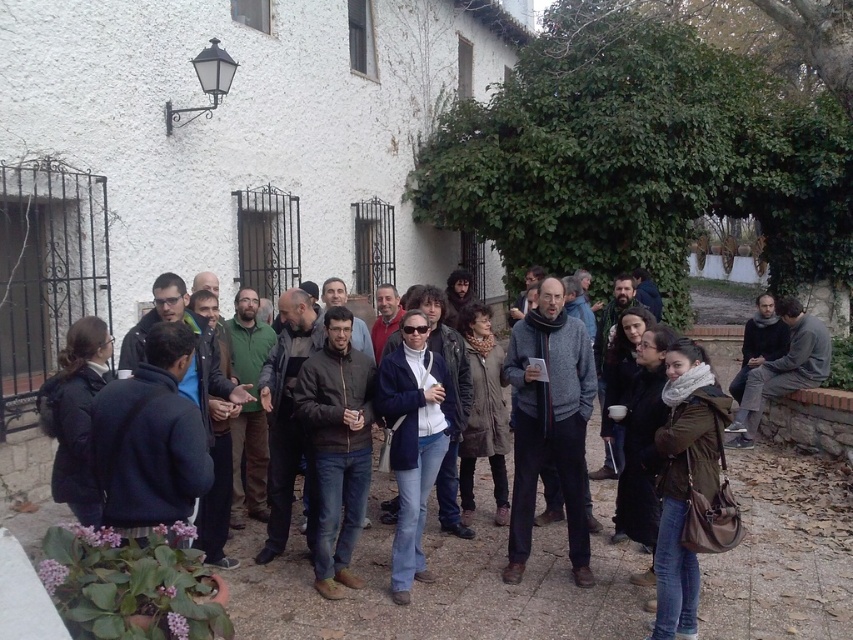
Question: Observing the image, what is the correct spatial positioning of dark brown leather jacket at center in reference to dark gray sweater at center?

Choices:
 (A) above
 (B) below

Answer: (B)

Question: Which of the following is the closest to the observer?

Choices:
 (A) dark brown leather jacket at center
 (B) dark gray sweater at center

Answer: (A)

Question: Is the position of dark brown leather jacket at center more distant than that of dark gray sweater at center?

Choices:
 (A) yes
 (B) no

Answer: (B)

Question: Can you confirm if dark brown leather jacket at center is smaller than dark gray sweater at center?

Choices:
 (A) yes
 (B) no

Answer: (B)